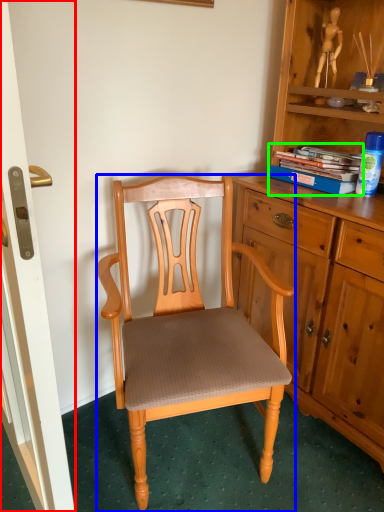
Question: Based on their relative distances, which object is farther from screen door (highlighted by a red box)? Choose from chair (highlighted by a blue box) and book (highlighted by a green box).

Choices:
 (A) chair
 (B) book

Answer: (B)